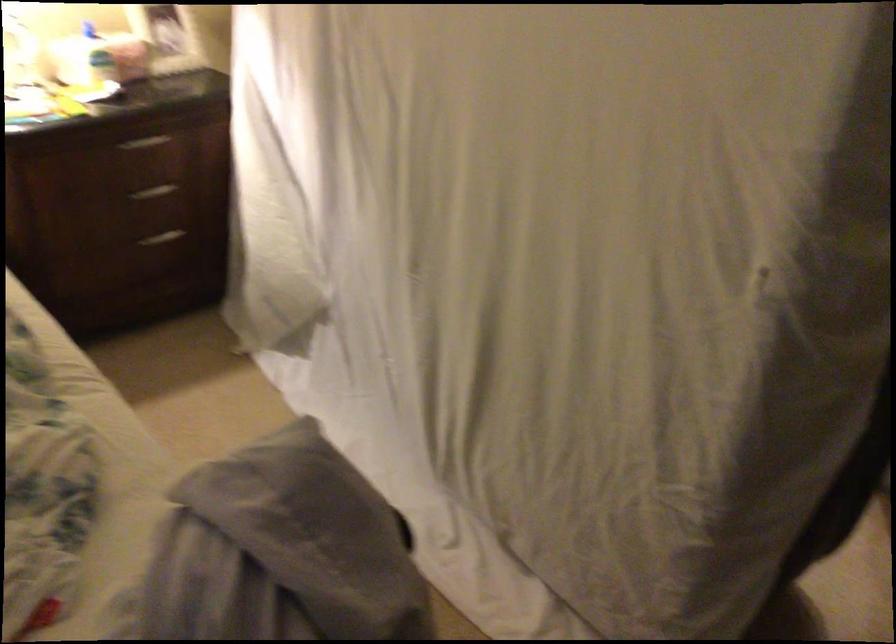
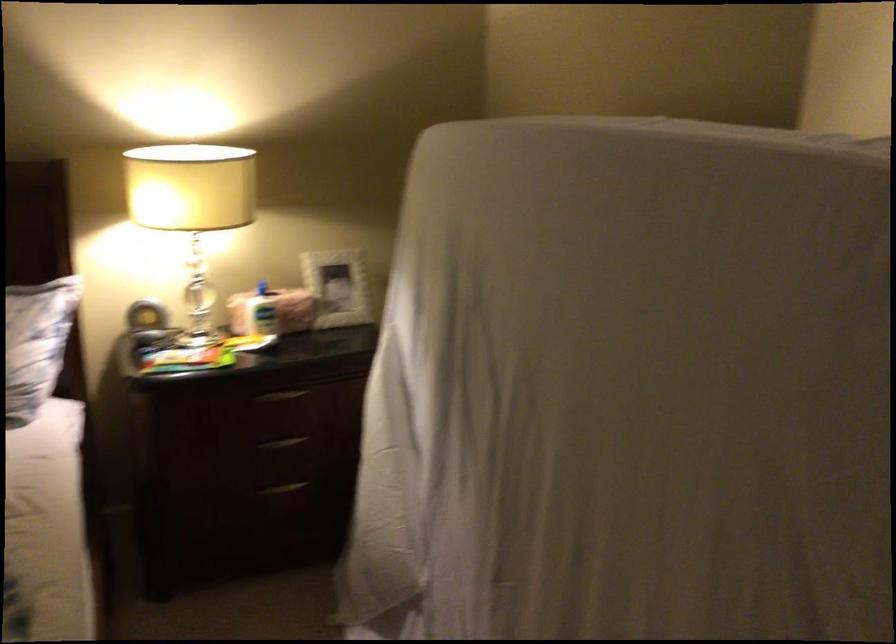
Locate, in the second image, the point that corresponds to point (152, 194) in the first image.

(282, 442)